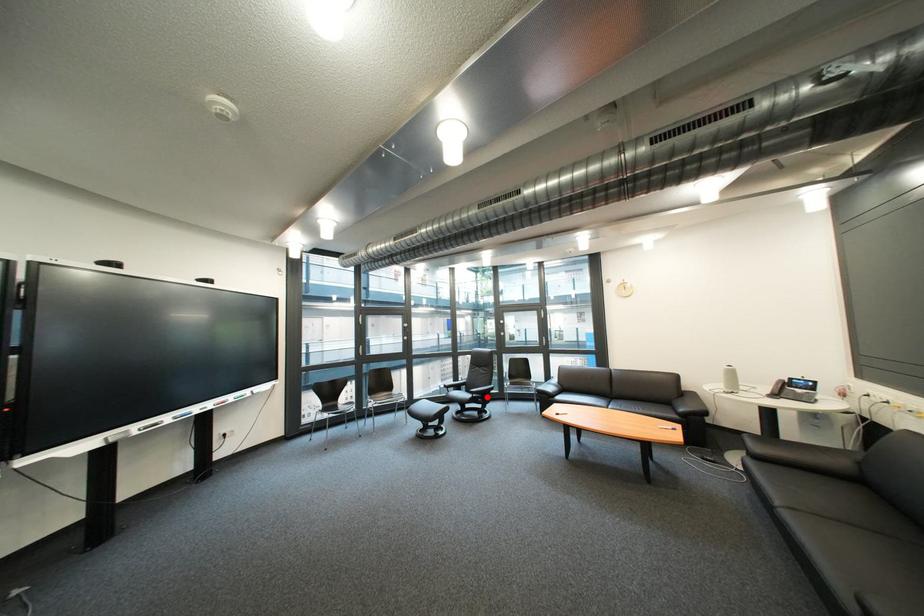
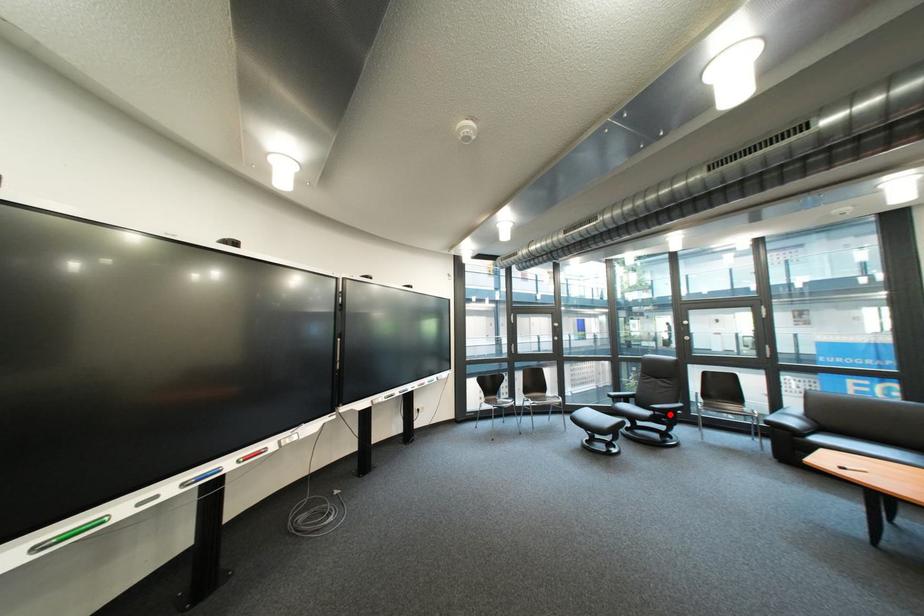
I am providing you with two images of the same scene from different viewpoints. A red point is marked on the first image and another point is marked on the second image. Does the point marked in image1 correspond to the same location as the one in image2?

Yes